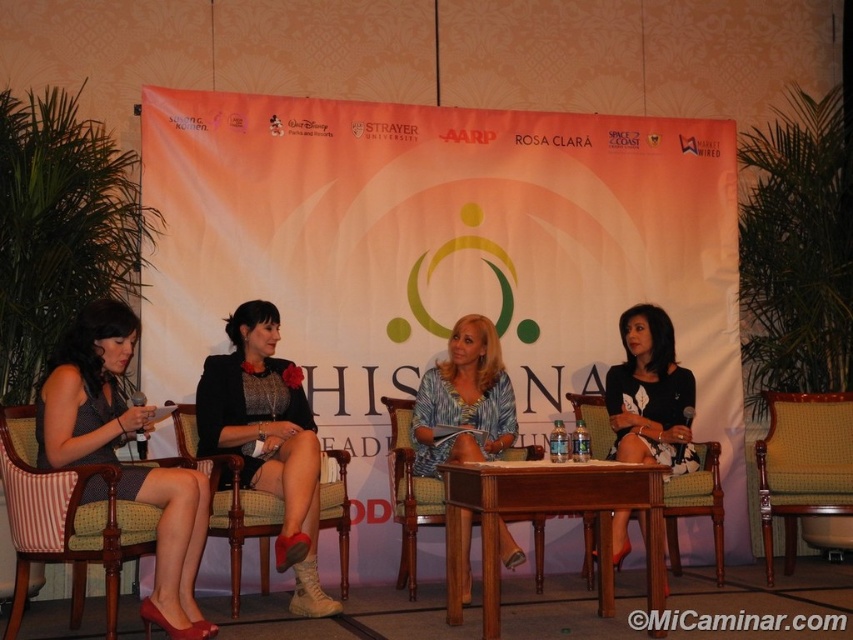
Question: Among these objects, which one is farthest from the camera?

Choices:
 (A) yellow fabric chair at center
 (B) wooden at center

Answer: (A)

Question: Can you confirm if wooden at center is smaller than wooden armchair at center?

Choices:
 (A) yes
 (B) no

Answer: (A)

Question: Does matte black dress at left lie in front of wooden armchair at center?

Choices:
 (A) yes
 (B) no

Answer: (A)

Question: Does wooden armchair at center have a greater width compared to green striped fabric chair at center?

Choices:
 (A) no
 (B) yes

Answer: (B)

Question: Which is nearer to the matte black dress at left?

Choices:
 (A) striped fabric chair at left
 (B) brown woven chair at center

Answer: (A)

Question: Which point is closer to the camera?

Choices:
 (A) (722, 582)
 (B) (47, 481)

Answer: (B)